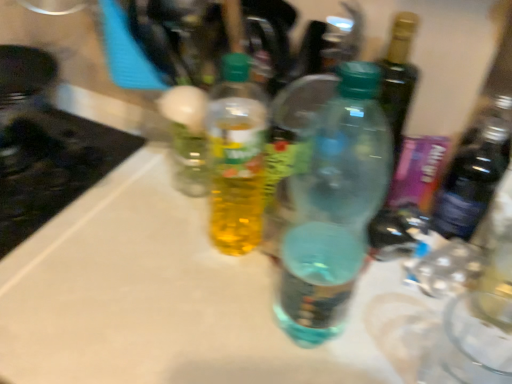
Identify the location of free space that is in between translucent plastic bottle at center, positioned as the first bottle in left-to-right order, and translucent plastic bottle at center, the second bottle from the left. (243, 298).